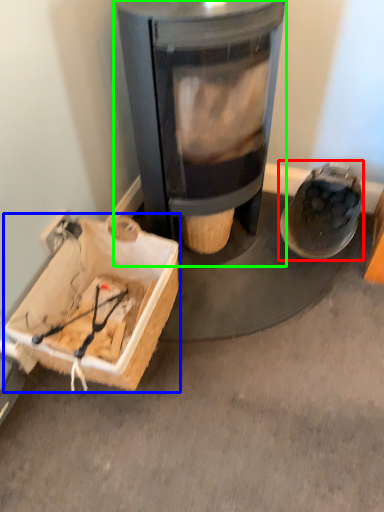
Question: Which object is the farthest from footwear (highlighted by a red box)? Choose among these: cardboard box (highlighted by a blue box) or wood burning stove (highlighted by a green box).

Choices:
 (A) cardboard box
 (B) wood burning stove

Answer: (A)